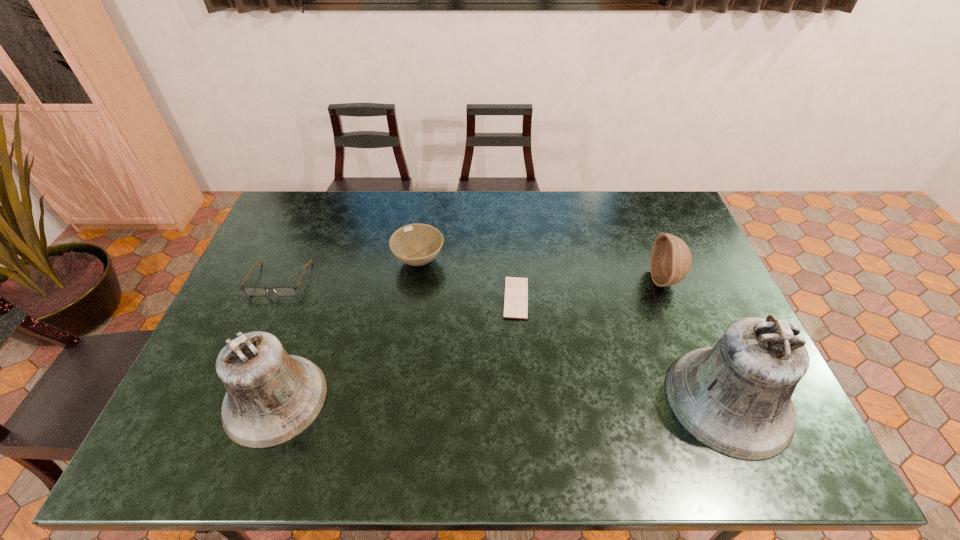
You are a GUI agent. You are given a task and a screenshot of the screen. Output one action in this format:
    pyautogui.click(x=<x>, y=<y>)
    Task: Click on the vacant region that satisfies the following two spatial constraints: 1. on the front-facing side of the diary; 2. on the right side of the spectacles
    
    Given the screenshot: What is the action you would take?
    pyautogui.click(x=272, y=298)

Locate an element on the screen. free point that satisfies the following two spatial constraints: 1. on the front side of the taller bell; 2. on the right side of the shorter bell is located at coordinates (276, 400).

Locate an element on the screen. The width and height of the screenshot is (960, 540). vacant point that satisfies the following two spatial constraints: 1. on the front side of the fourth object from right to left; 2. on the left side of the fourth shortest object is located at coordinates (417, 280).

Where is `blank area in the image that satisfies the following two spatial constraints: 1. on the front side of the taller bowl; 2. on the right side of the third object from left to right`? The width and height of the screenshot is (960, 540). blank area in the image that satisfies the following two spatial constraints: 1. on the front side of the taller bowl; 2. on the right side of the third object from left to right is located at coordinates (417, 280).

Where is `vacant space that satisfies the following two spatial constraints: 1. on the front side of the diary; 2. on the left side of the shorter bowl`? Image resolution: width=960 pixels, height=540 pixels. vacant space that satisfies the following two spatial constraints: 1. on the front side of the diary; 2. on the left side of the shorter bowl is located at coordinates (414, 298).

The image size is (960, 540). What are the coordinates of `blank space that satisfies the following two spatial constraints: 1. on the front side of the third tallest object; 2. on the left side of the right bell` in the screenshot? It's located at (713, 400).

Image resolution: width=960 pixels, height=540 pixels. Find the location of `free space that satisfies the following two spatial constraints: 1. on the back side of the third shortest object; 2. on the right side of the fifth shortest object`. free space that satisfies the following two spatial constraints: 1. on the back side of the third shortest object; 2. on the right side of the fifth shortest object is located at coordinates (324, 261).

Image resolution: width=960 pixels, height=540 pixels. Find the location of `vacant position in the image that satisfies the following two spatial constraints: 1. on the front side of the tallest object; 2. on the left side of the taller bowl`. vacant position in the image that satisfies the following two spatial constraints: 1. on the front side of the tallest object; 2. on the left side of the taller bowl is located at coordinates (713, 400).